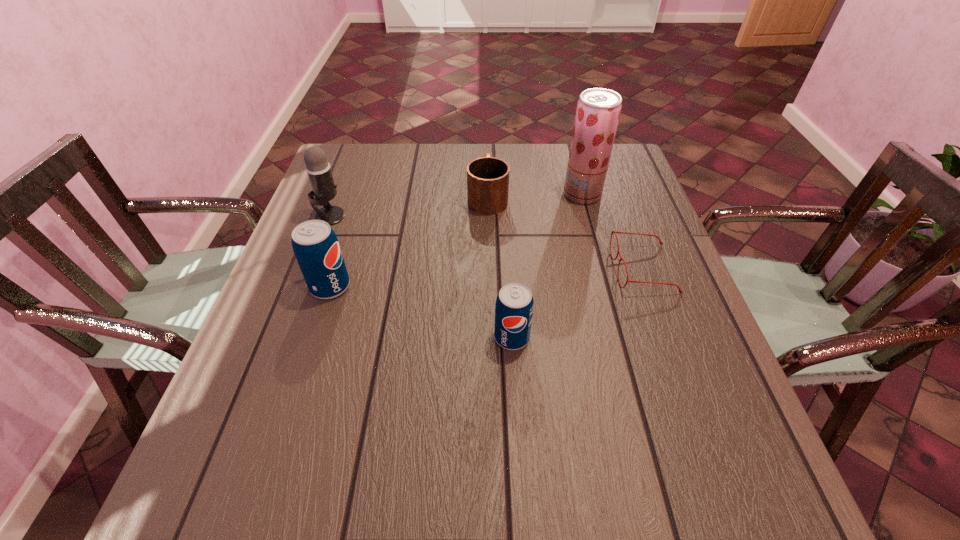
This screenshot has width=960, height=540. I want to click on vacant space at the far right corner of the desktop, so click(615, 146).

Locate an element on the screen. The width and height of the screenshot is (960, 540). vacant space at the near right corner of the desktop is located at coordinates (703, 412).

Where is `empty location between the shortest object and the nearest object`? This screenshot has height=540, width=960. empty location between the shortest object and the nearest object is located at coordinates pos(578,303).

Identify the location of free space between the second tallest object and the second shortest object. (409, 206).

You are a GUI agent. You are given a task and a screenshot of the screen. Output one action in this format:
    pyautogui.click(x=<x>, y=<y>)
    Task: Click on the unoccupied area between the mug and the nearest object
    This screenshot has width=960, height=540.
    Given the screenshot: What is the action you would take?
    pyautogui.click(x=500, y=267)

What are the coordinates of `vacant point located between the fifth shortest object and the tallest object` in the screenshot? It's located at (456, 205).

Locate an element on the screen. vacant space that is in between the fruit juice and the fifth shortest object is located at coordinates (456, 205).

You are a GUI agent. You are given a task and a screenshot of the screen. Output one action in this format:
    pyautogui.click(x=<x>, y=<y>)
    Task: Click on the vacant area that lies between the farther pop and the tallest object
    The image size is (960, 540).
    Given the screenshot: What is the action you would take?
    pyautogui.click(x=456, y=240)

Locate an element on the screen. unoccupied area between the mug and the spectacles is located at coordinates (565, 233).

Locate an element on the screen. Image resolution: width=960 pixels, height=540 pixels. vacant area that lies between the tallest object and the second shortest object is located at coordinates (535, 195).